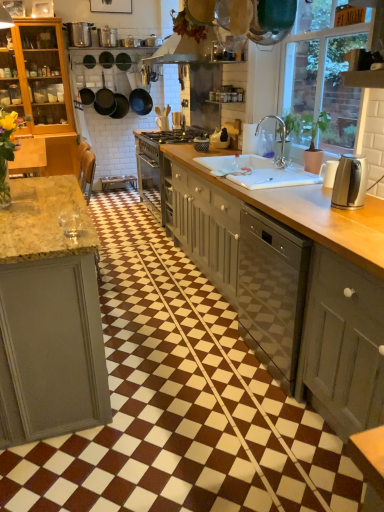
Where is `vacant space in front of gold metallic faucet at upper right`? The image size is (384, 512). vacant space in front of gold metallic faucet at upper right is located at coordinates (283, 169).